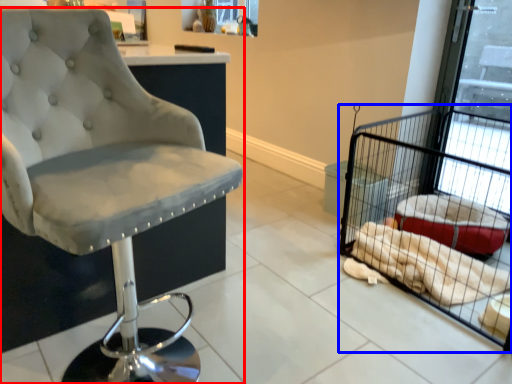
Question: Among these objects, which one is farthest to the camera, chair (highlighted by a red box) or bird cage (highlighted by a blue box)?

Choices:
 (A) chair
 (B) bird cage

Answer: (B)